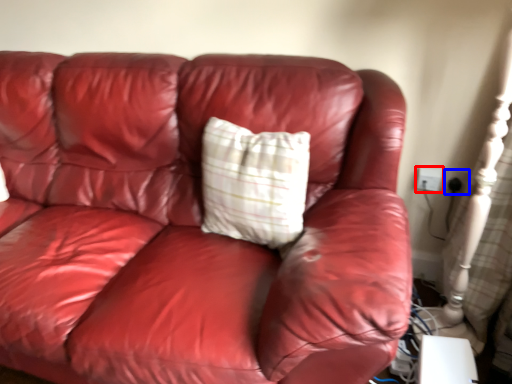
Question: Which object is further to the camera taking this photo, electric outlet (highlighted by a red box) or electric outlet (highlighted by a blue box)?

Choices:
 (A) electric outlet
 (B) electric outlet

Answer: (A)